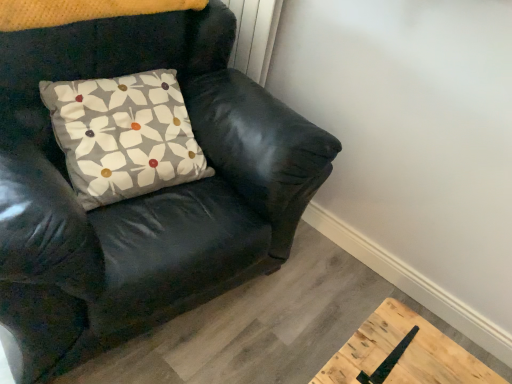
Question: Would you say black leather chair at upper left is to the left or to the right of floral-patterned fabric pillow at upper left in the picture?

Choices:
 (A) left
 (B) right

Answer: (A)

Question: Considering the positions of black leather chair at upper left and floral-patterned fabric pillow at upper left in the image, is black leather chair at upper left wider or thinner than floral-patterned fabric pillow at upper left?

Choices:
 (A) thin
 (B) wide

Answer: (B)

Question: Is black leather chair at upper left taller or shorter than floral-patterned fabric pillow at upper left?

Choices:
 (A) tall
 (B) short

Answer: (A)

Question: Considering the positions of point (59, 114) and point (4, 271), is point (59, 114) closer or farther from the camera than point (4, 271)?

Choices:
 (A) farther
 (B) closer

Answer: (A)

Question: Is floral-patterned fabric pillow at upper left wider or thinner than black leather chair at upper left?

Choices:
 (A) wide
 (B) thin

Answer: (B)

Question: Considering their positions, is floral-patterned fabric pillow at upper left located in front of or behind black leather chair at upper left?

Choices:
 (A) behind
 (B) front

Answer: (A)

Question: From a real-world perspective, is floral-patterned fabric pillow at upper left physically located above or below black leather chair at upper left?

Choices:
 (A) above
 (B) below

Answer: (A)